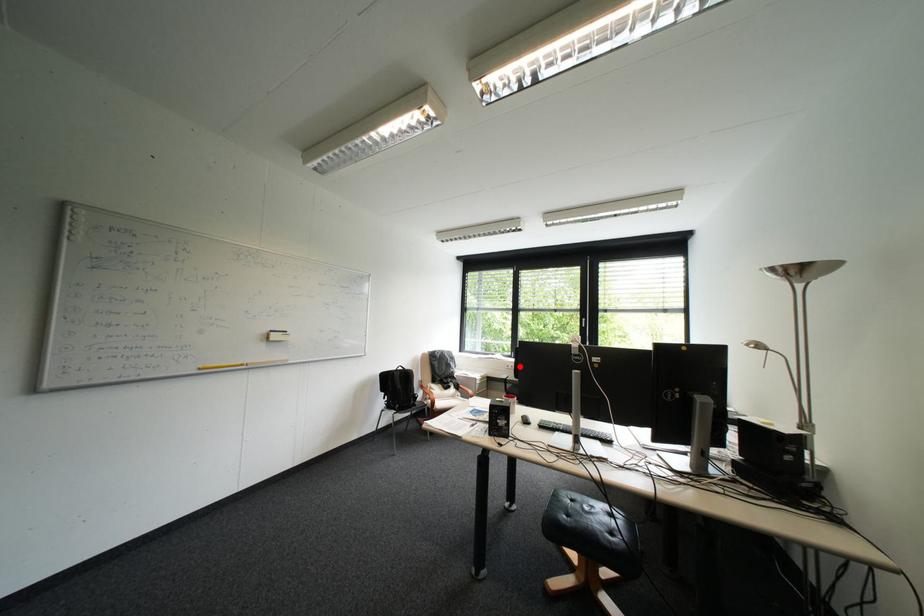
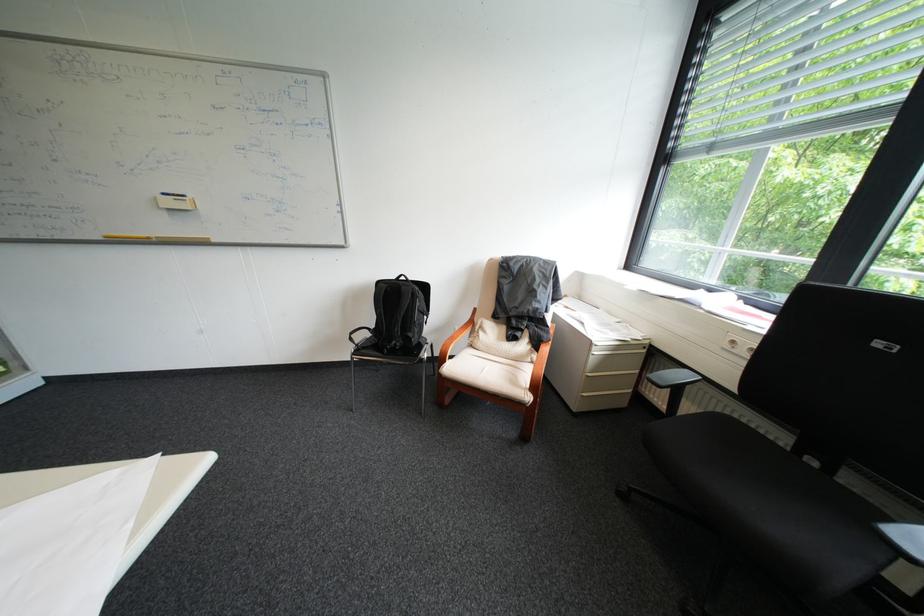
Where in the second image is the point corresponding to the highlighted location from the first image?

(746, 342)